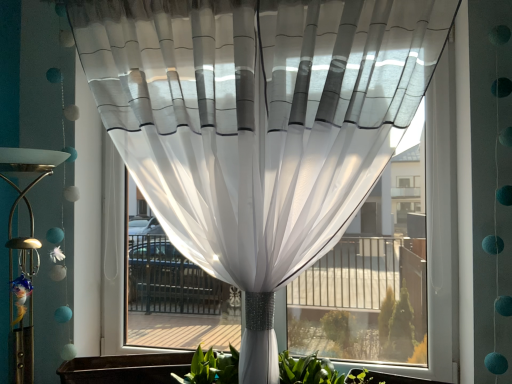
What do you see at coordinates (315, 371) in the screenshot? The width and height of the screenshot is (512, 384). I see `green leafy plant at center` at bounding box center [315, 371].

Find the location of `green leafy plant at center`. green leafy plant at center is located at coordinates (315, 371).

What are the coordinates of `green leafy plant at center` in the screenshot? It's located at click(315, 371).